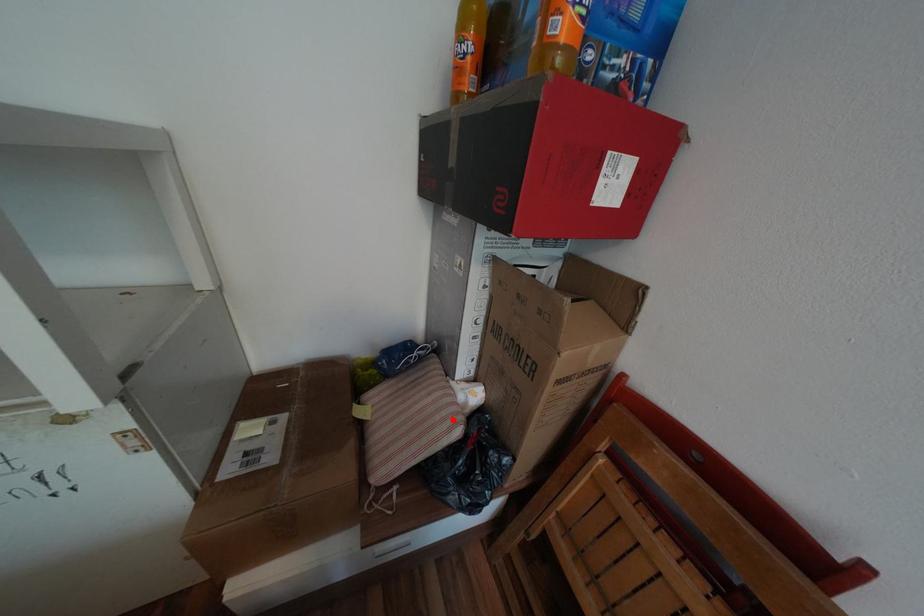
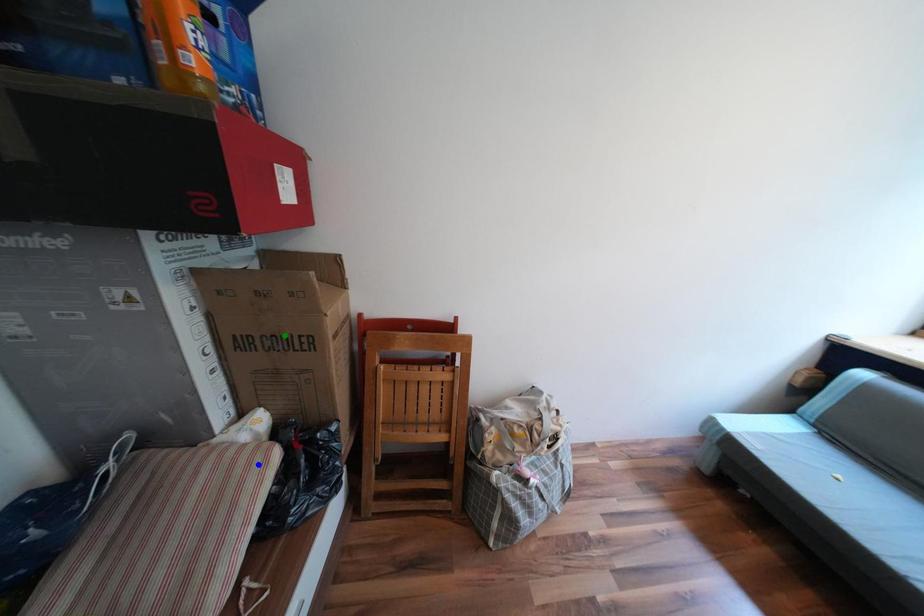
Question: I am providing you with two images of the same scene from different viewpoints. A red point is marked on the first image. You are given multiple points on the second image. Which point in image 2 represents the same 3d spot as the red point in image 1?

Choices:
 (A) yellow point
 (B) green point
 (C) blue point

Answer: (C)